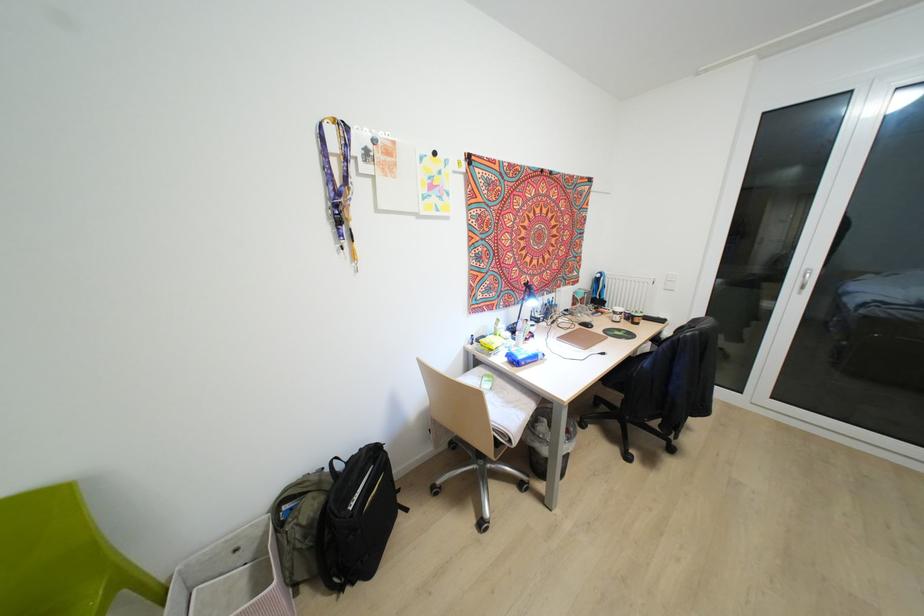
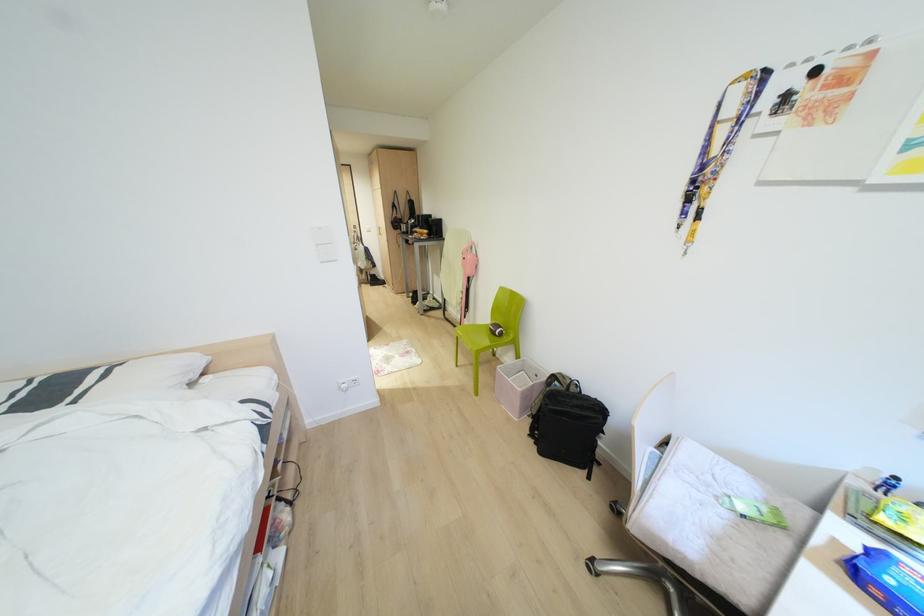
How did the camera likely rotate?

The camera rotated toward left-down.